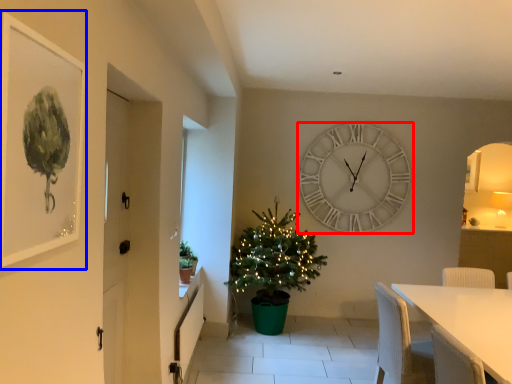
Question: Which point is closer to the camera, wall clock (highlighted by a red box) or picture frame (highlighted by a blue box)?

Choices:
 (A) wall clock
 (B) picture frame

Answer: (B)